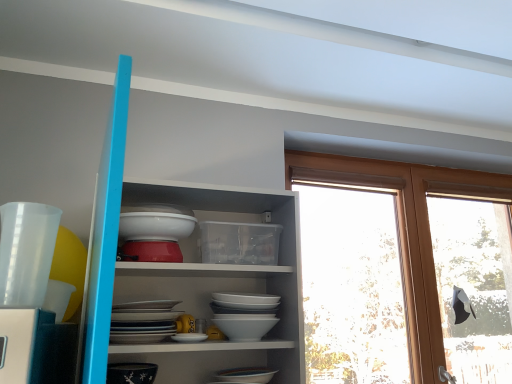
At what (x,y) coordinates should I click in order to perform the action: click on vacant point above transparent glass window at upper right (from a real-world perspective). Please return your answer as a coordinate pair (x, y). This screenshot has width=512, height=384. Looking at the image, I should click on (425, 165).